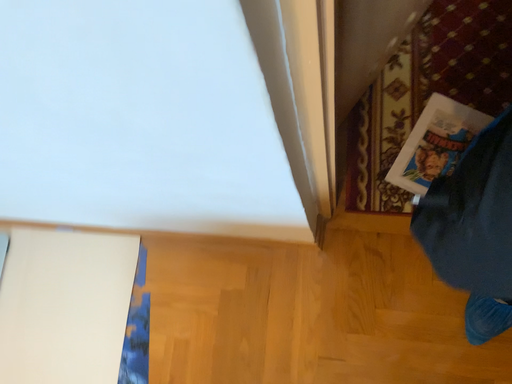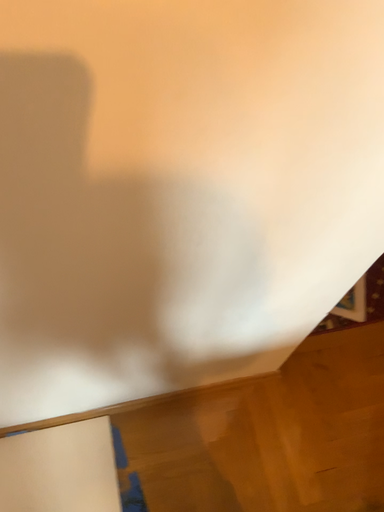
Question: Which way did the camera rotate in the video?

Choices:
 (A) rotated right
 (B) rotated left

Answer: (A)